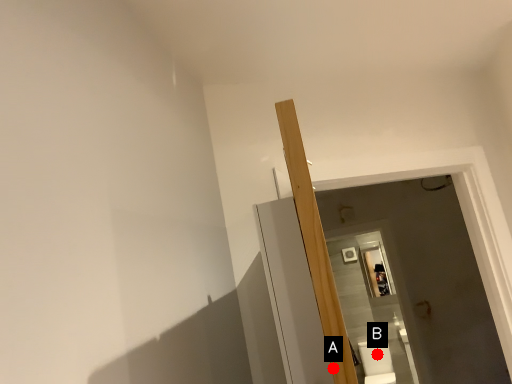
Question: Two points are circled on the image, labeled by A and B beside each circle. Among these points, which one is nearest to the camera?

Choices:
 (A) A is closer
 (B) B is closer

Answer: (A)